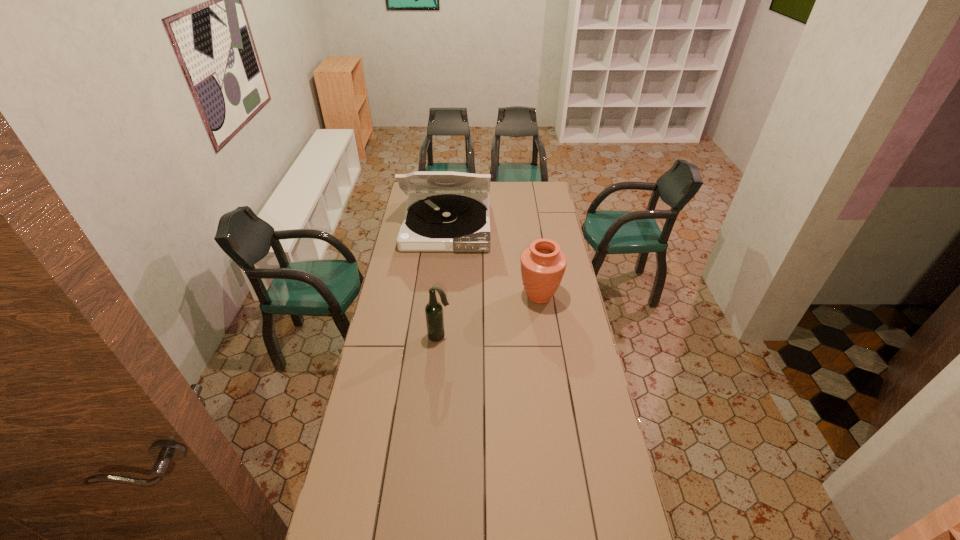
You are a GUI agent. You are given a task and a screenshot of the screen. Output one action in this format:
    pyautogui.click(x=<x>, y=<y>)
    Task: Click on the blank area in the image that satisfies the following two spatial constraints: 1. on the control panel of the rightmost object; 2. on the left side of the CD player
    
    Given the screenshot: What is the action you would take?
    pyautogui.click(x=440, y=296)

Find the location of `free space that satisfies the following two spatial constraints: 1. on the control panel of the beer bottle; 2. on the left side of the CD player`. free space that satisfies the following two spatial constraints: 1. on the control panel of the beer bottle; 2. on the left side of the CD player is located at coordinates [436, 336].

The height and width of the screenshot is (540, 960). Identify the location of vacant point that satisfies the following two spatial constraints: 1. on the control panel of the CD player; 2. on the right side of the beer bottle. (436, 336).